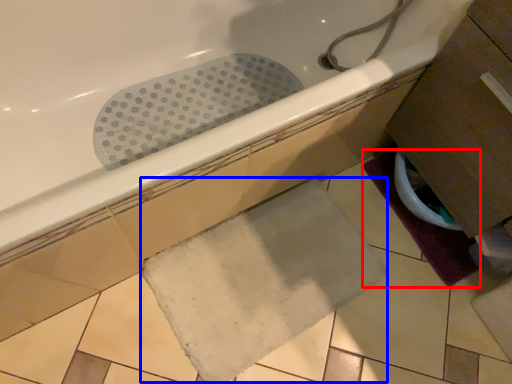
Question: Which point is closer to the camera, bath mat (highlighted by a red box) or bath mat (highlighted by a blue box)?

Choices:
 (A) bath mat
 (B) bath mat

Answer: (B)